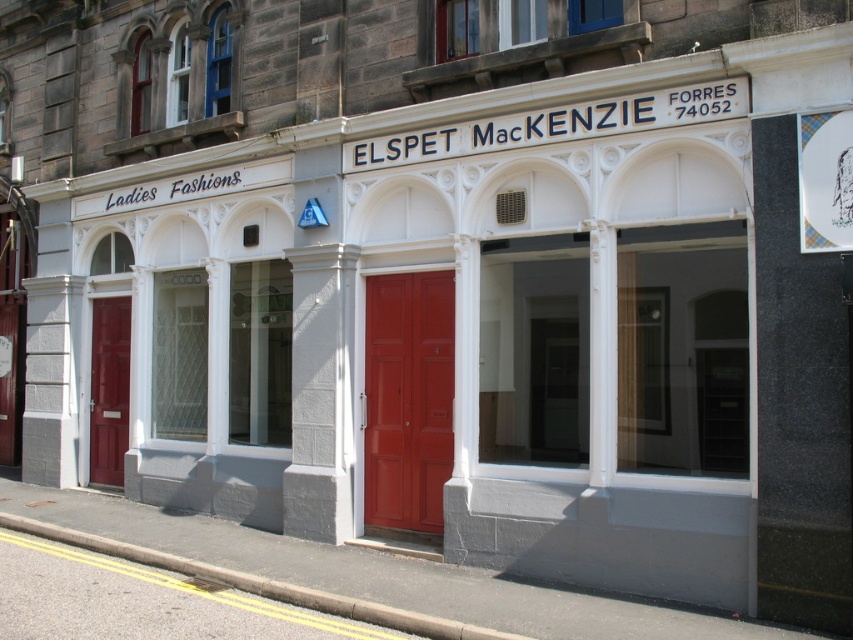
Between matte red door at center and matte red door at left, which one is positioned higher?

matte red door at center

Is matte red door at center bigger than matte red door at left?

Yes, matte red door at center is bigger than matte red door at left.

Between point (426, 451) and point (102, 412), which one is positioned in front?

Point (426, 451)

Find the location of a particular element. The image size is (853, 640). matte red door at center is located at coordinates (408, 397).